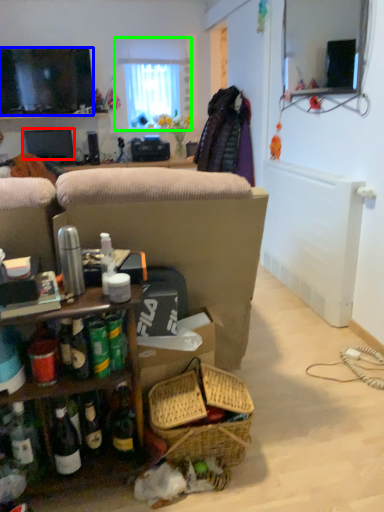
Question: Based on their relative distances, which object is nearer to television (highlighted by a red box)? Choose from television (highlighted by a blue box) and window (highlighted by a green box).

Choices:
 (A) television
 (B) window

Answer: (A)